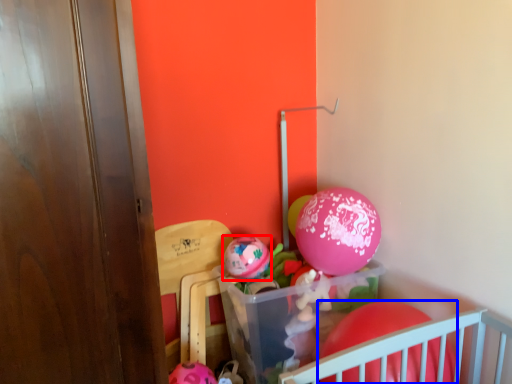
Question: Which of the following is the closest to the observer, balloon (highlighted by a red box) or balloon (highlighted by a blue box)?

Choices:
 (A) balloon
 (B) balloon

Answer: (B)